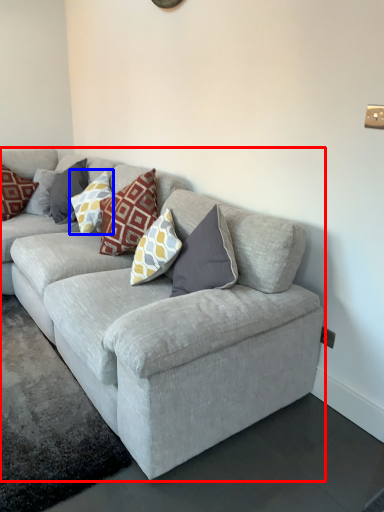
Question: Which point is closer to the camera, studio couch (highlighted by a red box) or pillow (highlighted by a blue box)?

Choices:
 (A) studio couch
 (B) pillow

Answer: (A)